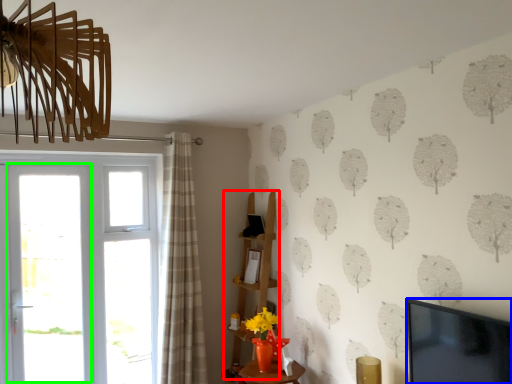
Question: Based on their relative distances, which object is nearer to shelf (highlighted by a red box)? Choose from television (highlighted by a blue box) and screen door (highlighted by a green box).

Choices:
 (A) television
 (B) screen door

Answer: (B)